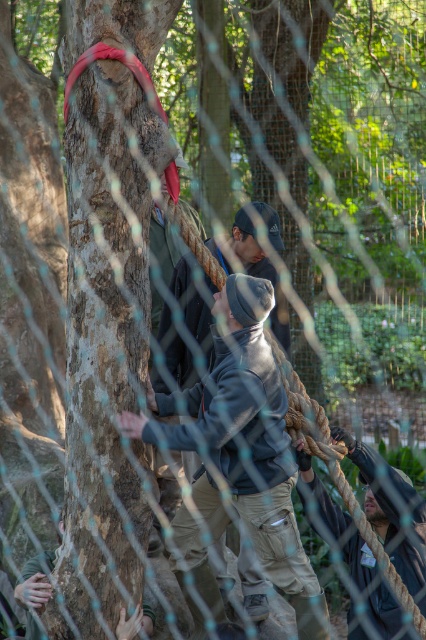
Based on the photo, you are a hiker trying to decide which item to grab first. The gray fleece jacket at center and the dark gray fabric at lower right are both in your view. Which item is taller?

The gray fleece jacket at center is much taller than the dark gray fabric at lower right.

You are standing outside the forest looking through the chain link fence. You see a gray fleece jacket at center and a dark gray fabric at lower right. Which object is closer to the left side of your view?

The gray fleece jacket at center is closer to the left side of your view because it is to the left of the dark gray fabric at lower right.

You are standing outside the forest and looking through the chain link fence. You see a gray fleece jacket at center and a dark gray fabric at lower right. Which object is higher in the image?

The gray fleece jacket at center is above dark gray fabric at lower right, so the gray fleece jacket at center is higher in the image.